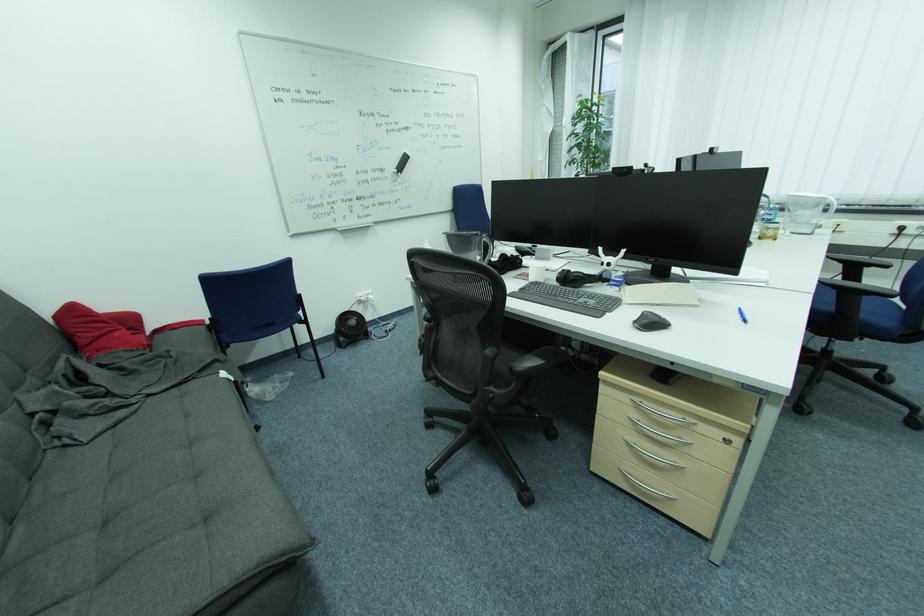
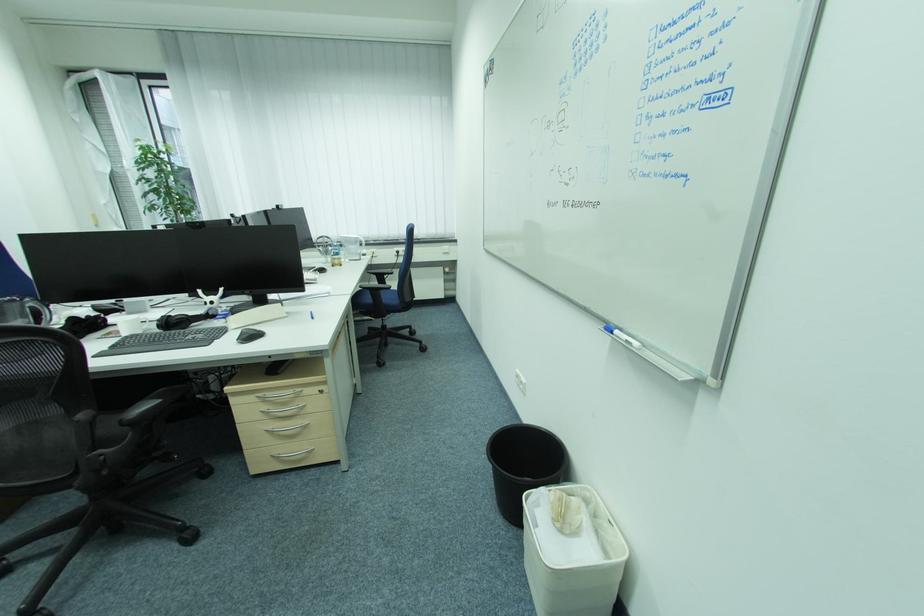
Find the pixel in the second image that matches point (641, 446) in the first image.

(281, 430)